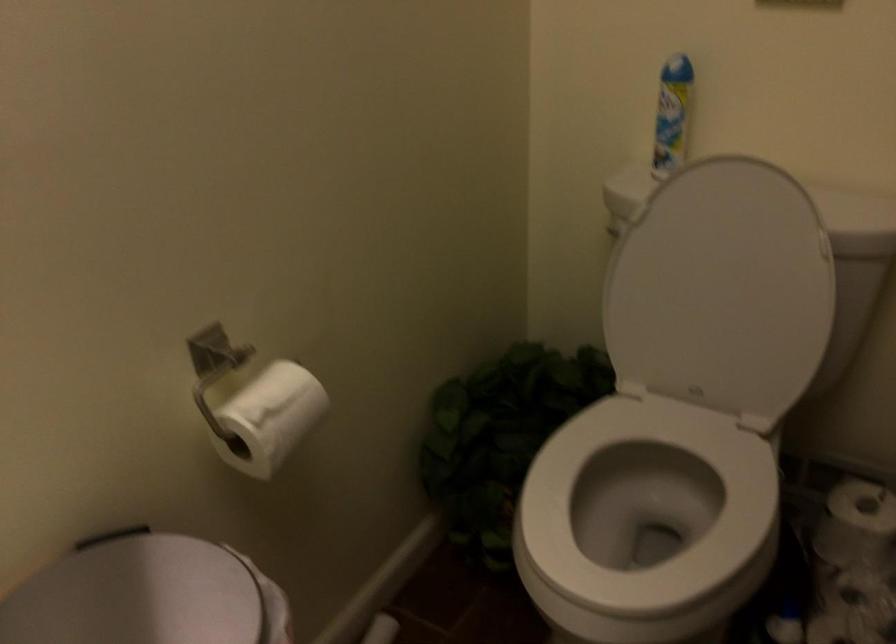
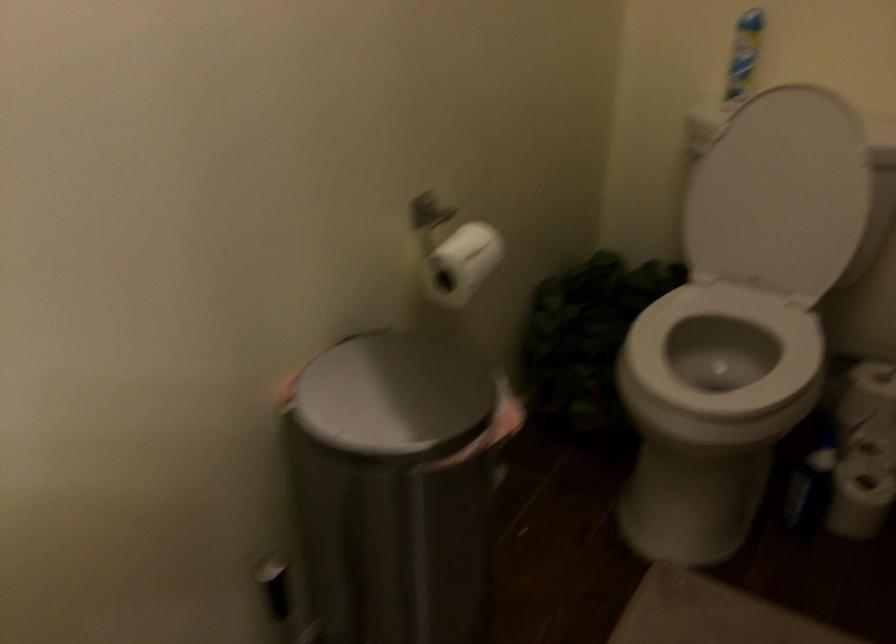
What movement of the cameraman would produce the second image?

The cameraman moved toward left, backward.